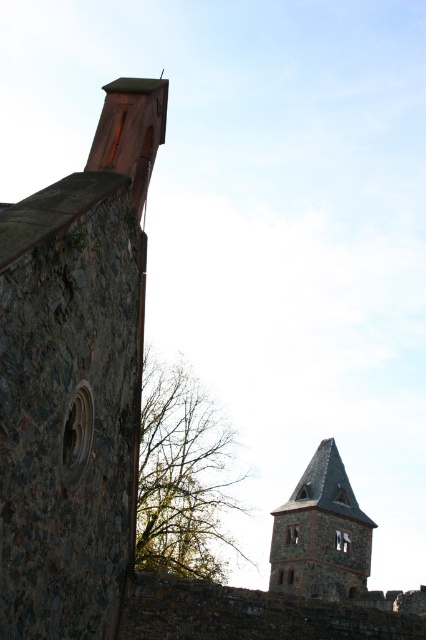
Does rustic stone tower at upper right have a greater width compared to gray stone tower at center?

Incorrect, rustic stone tower at upper right's width does not surpass gray stone tower at center's.

Is rustic stone tower at upper right above gray stone tower at center?

Indeed, rustic stone tower at upper right is positioned over gray stone tower at center.

Is point (60, 212) closer to viewer compared to point (305, 477)?

Yes, it is.

The image size is (426, 640). What are the coordinates of `rustic stone tower at upper right` in the screenshot? It's located at (74, 378).